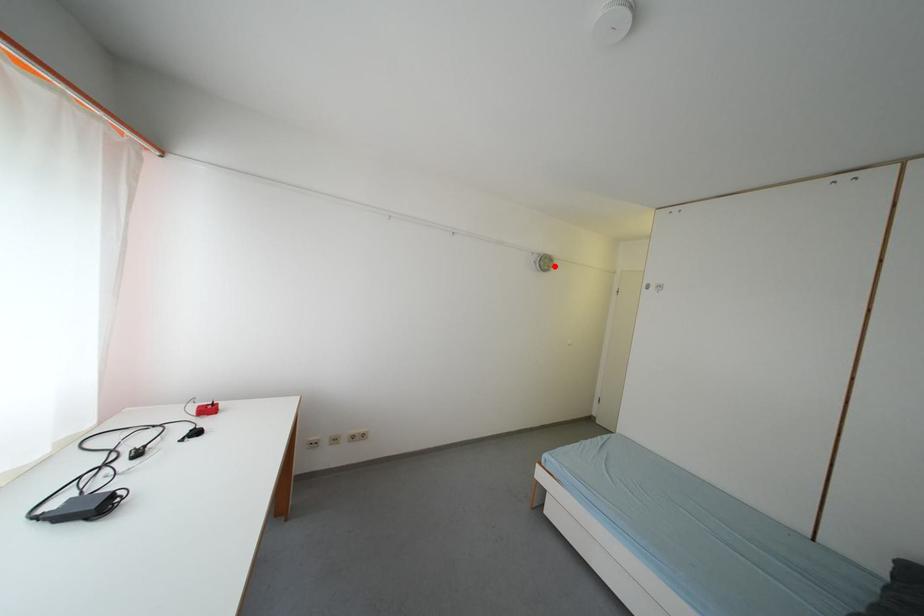
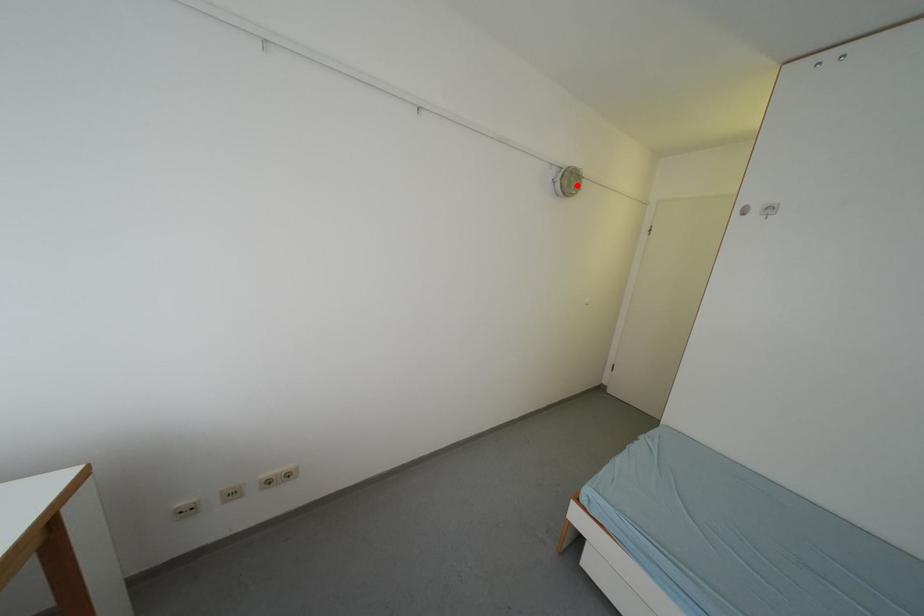
I am providing you with two images of the same scene from different viewpoints. A red point is marked on the first image and another point is marked on the second image. Does the point marked in image1 correspond to the same location as the one in image2?

Yes